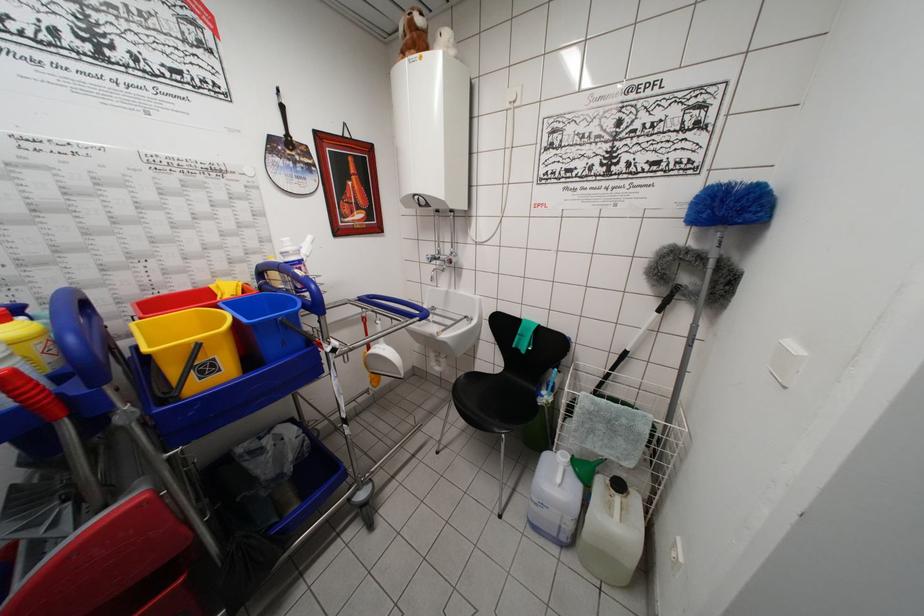
Identify the location of blue bucket handle. This screenshot has width=924, height=616. (304, 334).